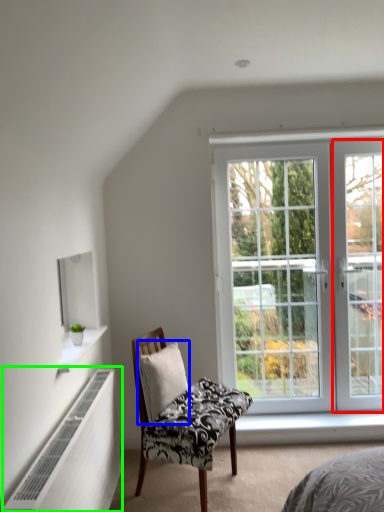
Question: Estimate the real-world distances between objects in this image. Which object is closer to screen door (highlighted by a red box), pillow (highlighted by a blue box) or radiator (highlighted by a green box)?

Choices:
 (A) pillow
 (B) radiator

Answer: (A)